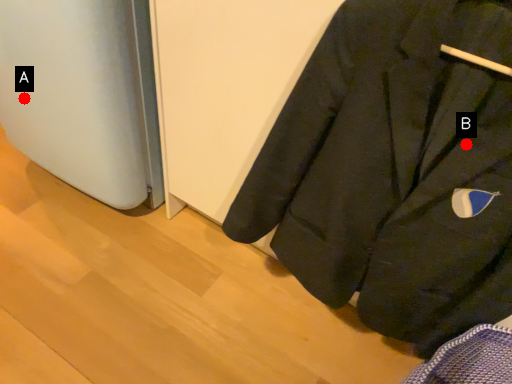
Question: Two points are circled on the image, labeled by A and B beside each circle. Which point is closer to the camera?

Choices:
 (A) A is closer
 (B) B is closer

Answer: (B)